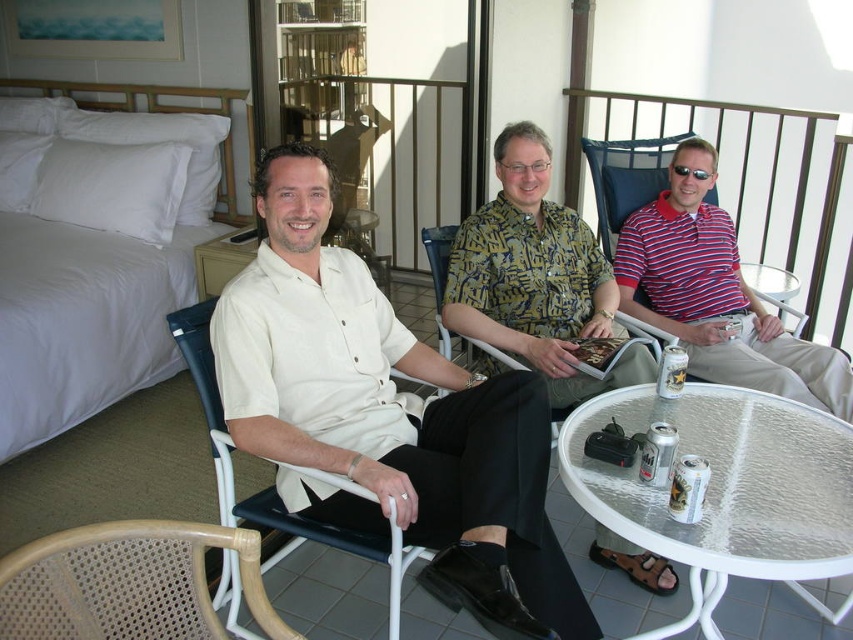
You are a guest in this room and need to choose a chair that is shorter in height for a child. Which chair between the woven wood chair at lower left and the white plastic chair at center would be more suitable?

The woven wood chair at lower left is shorter in height compared to the white plastic chair at center, making it more suitable for a child.

You are trying to decide which shirt to wear for a casual dinner. Both the matte white shirt at center and the printed fabric shirt at center are options. Based on the image, which one has a wider design?

The matte white shirt at center is wider than the printed fabric shirt at center according to the description.

You are a photographer trying to capture the matte white shirt at center and the printed fabric shirt at center in a single frame. Based on their positions, can you determine which shirt will be more visible in the photo?

The printed fabric shirt at center is more visible because the matte white shirt at center is positioned under it, so it might be partially or fully obscured.